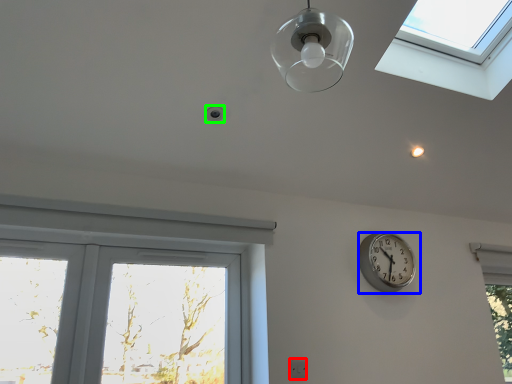
Question: Which is farther away from electric outlet (highlighted by a red box)? wall clock (highlighted by a blue box) or droplight (highlighted by a green box)?

Choices:
 (A) wall clock
 (B) droplight

Answer: (B)